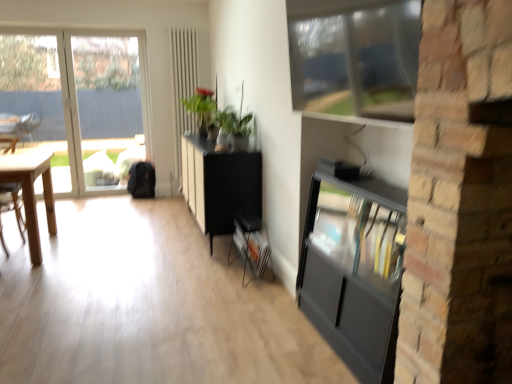
The image size is (512, 384). I want to click on free space between light wood desk at left and black matte cabinet at center, so click(x=125, y=241).